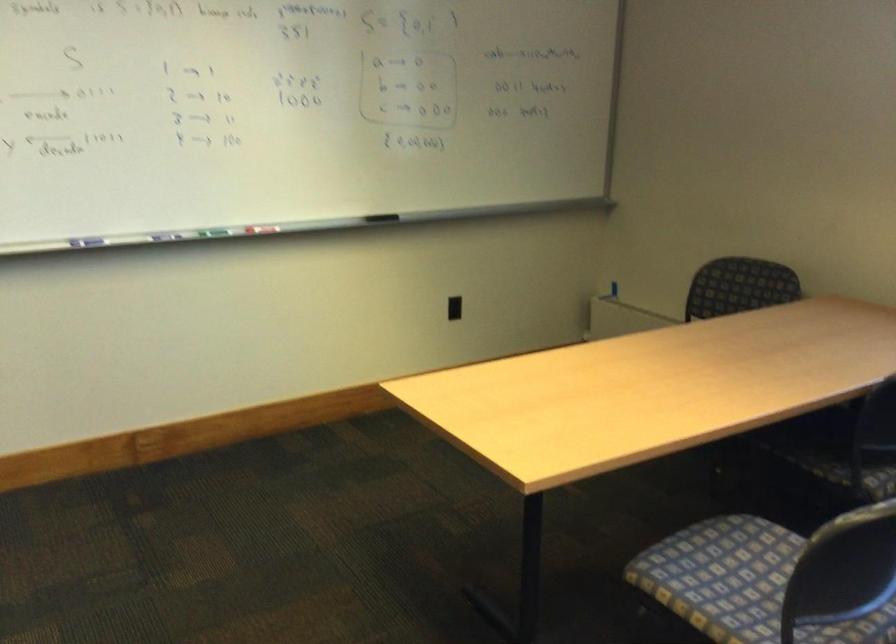
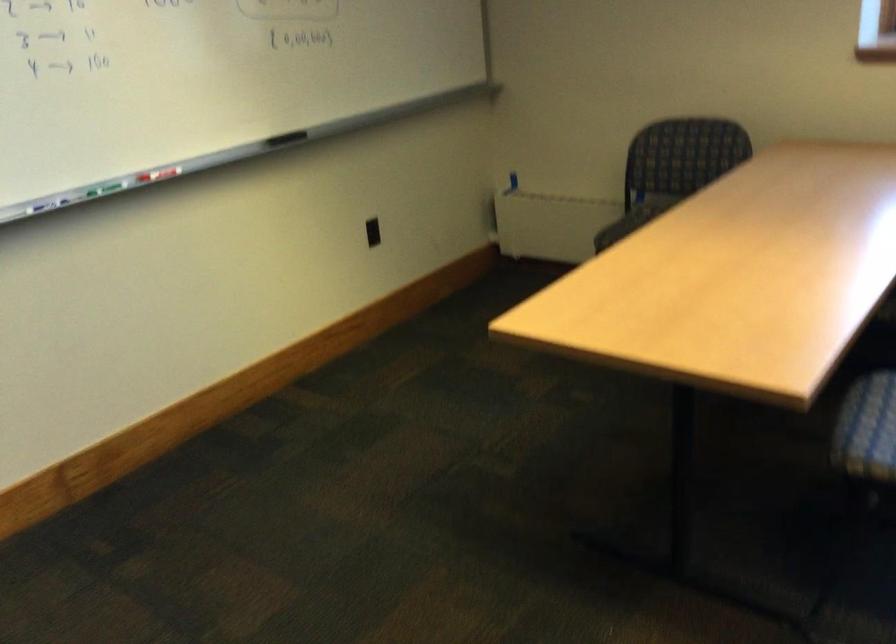
Where in the second image is the point corresponding to (x=727, y=538) from the first image?

(875, 389)